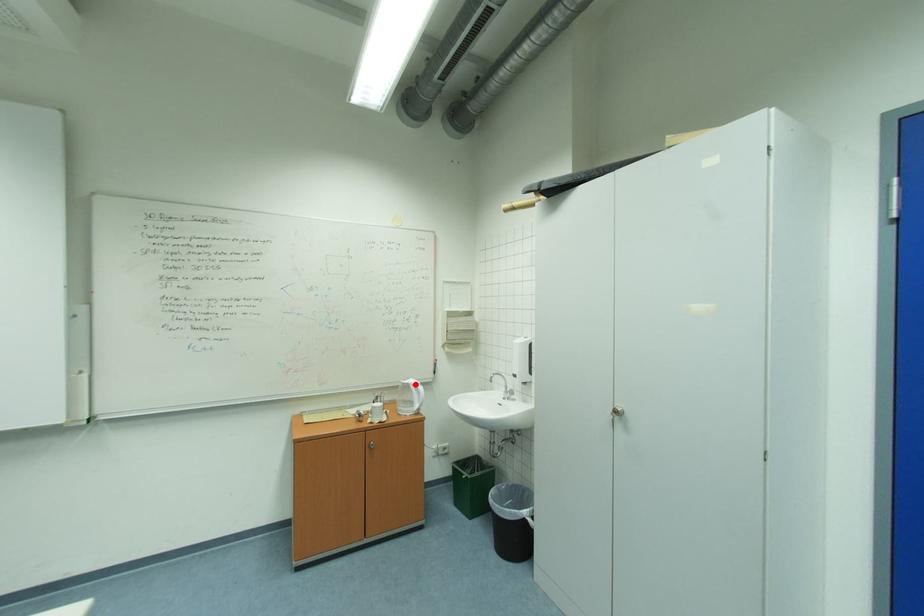
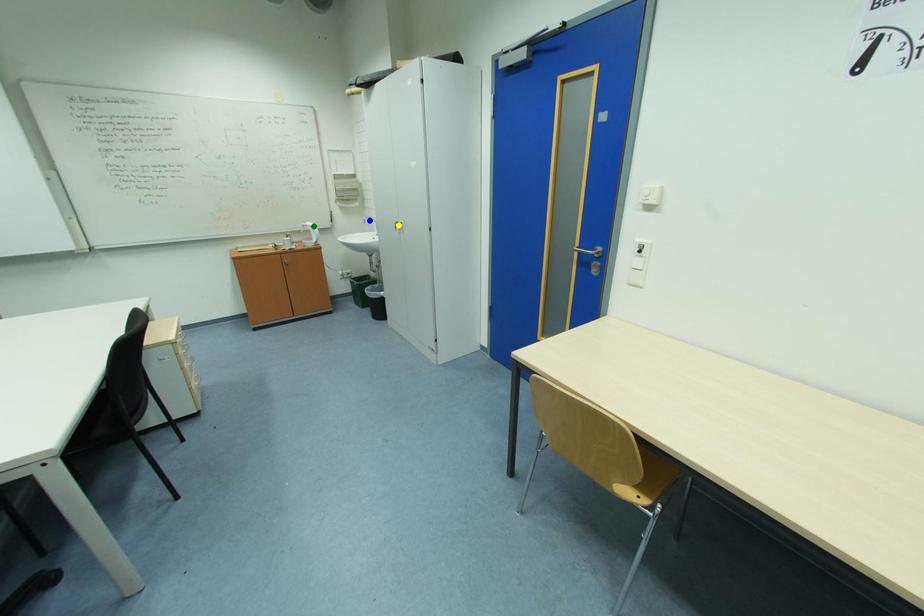
Question: I am providing you with two images of the same scene from different viewpoints. A red point is marked on the first image. You are given multiple points on the second image. Which mark in image 2 goes with the point in image 1?

Choices:
 (A) green point
 (B) blue point
 (C) yellow point

Answer: (A)